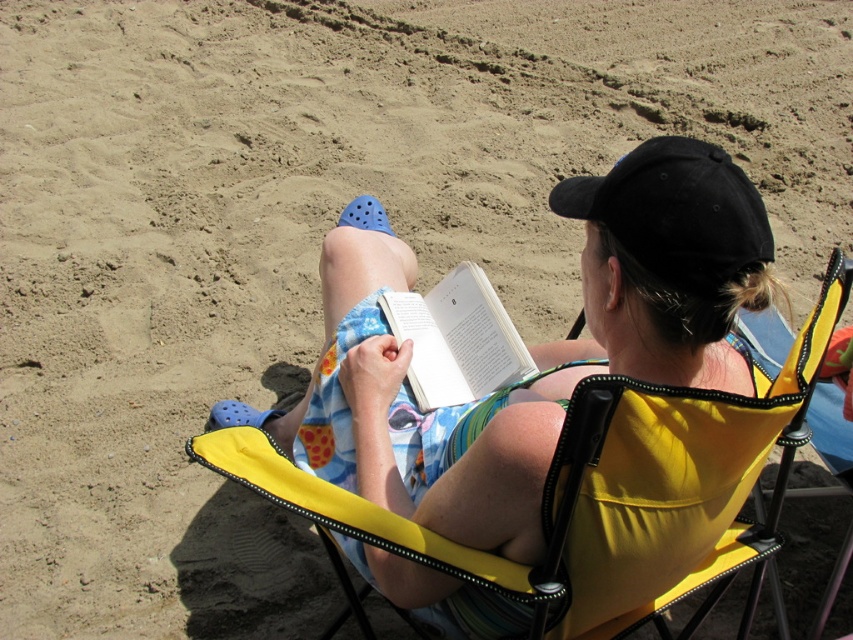
Is floral fabric dress at center thinner than black matte baseball cap at upper right?

In fact, floral fabric dress at center might be wider than black matte baseball cap at upper right.

Consider the image. Who is more forward, (x=688, y=291) or (x=654, y=212)?

Point (x=654, y=212) is in front.

The height and width of the screenshot is (640, 853). I want to click on floral fabric dress at center, so click(529, 348).

Between floral fabric dress at center and white paper book at center, which one is positioned higher?

white paper book at center is above.

Who is positioned more to the left, floral fabric dress at center or white paper book at center?

From the viewer's perspective, floral fabric dress at center appears more on the left side.

Find the location of a particular element. This screenshot has height=640, width=853. floral fabric dress at center is located at coordinates (529, 348).

Can you confirm if black matte baseball cap at upper right is shorter than white paper book at center?

Indeed, black matte baseball cap at upper right has a lesser height compared to white paper book at center.

Which of these two, black matte baseball cap at upper right or white paper book at center, stands shorter?

black matte baseball cap at upper right

Where is `black matte baseball cap at upper right`? black matte baseball cap at upper right is located at coordinates (676, 212).